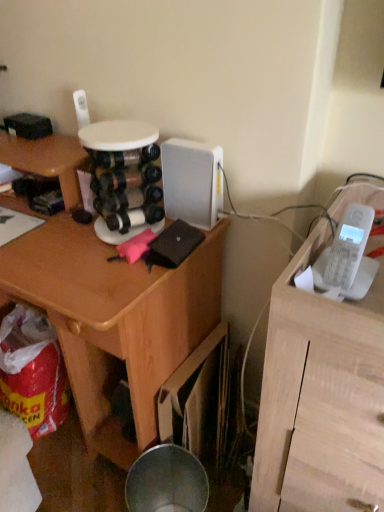
Question: Considering the positions of point (332, 271) and point (339, 424), is point (332, 271) closer or farther from the camera than point (339, 424)?

Choices:
 (A) closer
 (B) farther

Answer: (A)

Question: Considering the relative positions of white plastic phone at right and white matte telephone at upper right in the image provided, is white plastic phone at right to the left or to the right of white matte telephone at upper right?

Choices:
 (A) right
 (B) left

Answer: (B)

Question: Which object is positioned closest to the white matte telephone at upper right?

Choices:
 (A) white plastic phone at right
 (B) wooden desk at center

Answer: (A)

Question: Which object is the closest to the wooden desk at center?

Choices:
 (A) white matte telephone at upper right
 (B) white plastic phone at right

Answer: (A)